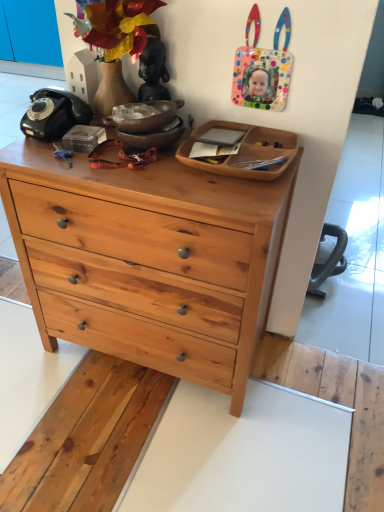
Question: Considering the relative sizes of natural wood chest of drawers at center and wooden tray at center in the image provided, is natural wood chest of drawers at center taller than wooden tray at center?

Choices:
 (A) yes
 (B) no

Answer: (A)

Question: Can you confirm if natural wood chest of drawers at center is wider than wooden tray at center?

Choices:
 (A) yes
 (B) no

Answer: (A)

Question: Does natural wood chest of drawers at center appear on the right side of wooden tray at center?

Choices:
 (A) no
 (B) yes

Answer: (A)

Question: Is natural wood chest of drawers at center far away from wooden tray at center?

Choices:
 (A) yes
 (B) no

Answer: (B)

Question: Is natural wood chest of drawers at center positioned behind wooden tray at center?

Choices:
 (A) yes
 (B) no

Answer: (B)

Question: From the image's perspective, is natural wood chest of drawers at center located above wooden tray at center?

Choices:
 (A) yes
 (B) no

Answer: (B)

Question: Are wooden tray at center and natural wood chest of drawers at center far apart?

Choices:
 (A) no
 (B) yes

Answer: (A)

Question: Is wooden tray at center smaller than natural wood chest of drawers at center?

Choices:
 (A) yes
 (B) no

Answer: (A)

Question: Does wooden tray at center have a larger size compared to natural wood chest of drawers at center?

Choices:
 (A) no
 (B) yes

Answer: (A)

Question: Is wooden tray at center not inside natural wood chest of drawers at center?

Choices:
 (A) yes
 (B) no

Answer: (A)

Question: Does wooden tray at center have a lesser height compared to natural wood chest of drawers at center?

Choices:
 (A) no
 (B) yes

Answer: (B)

Question: From a real-world perspective, is wooden tray at center located beneath natural wood chest of drawers at center?

Choices:
 (A) yes
 (B) no

Answer: (B)

Question: Is wooden tray at center taller or shorter than natural wood chest of drawers at center?

Choices:
 (A) short
 (B) tall

Answer: (A)